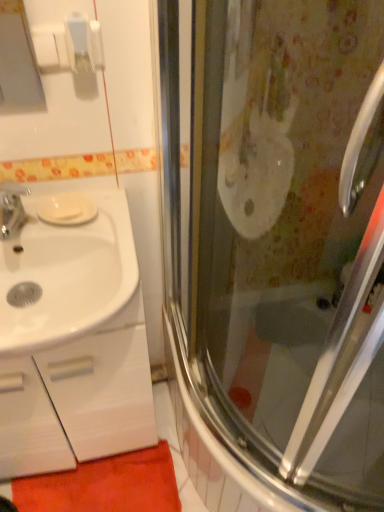
Question: Does white glossy sink at left touch white matte soap at left?

Choices:
 (A) no
 (B) yes

Answer: (A)

Question: Are white glossy sink at left and white matte soap at left located far from each other?

Choices:
 (A) yes
 (B) no

Answer: (B)

Question: Is white glossy sink at left shorter than white matte soap at left?

Choices:
 (A) no
 (B) yes

Answer: (A)

Question: Is white glossy sink at left to the right of white matte soap at left from the viewer's perspective?

Choices:
 (A) yes
 (B) no

Answer: (B)

Question: Is white glossy sink at left thinner than white matte soap at left?

Choices:
 (A) no
 (B) yes

Answer: (A)

Question: Considering the positions of point (74, 212) and point (97, 228), is point (74, 212) closer or farther from the camera than point (97, 228)?

Choices:
 (A) farther
 (B) closer

Answer: (A)

Question: Would you say white matte soap at left is inside or outside white glossy sink at left?

Choices:
 (A) inside
 (B) outside

Answer: (A)

Question: Relative to white glossy sink at left, is white matte soap at left in front or behind?

Choices:
 (A) front
 (B) behind

Answer: (B)

Question: Considering the positions of white matte soap at left and white glossy sink at left in the image, is white matte soap at left taller or shorter than white glossy sink at left?

Choices:
 (A) tall
 (B) short

Answer: (B)

Question: From a real-world perspective, is white glossy cabinet at left above or below white glossy sink at left?

Choices:
 (A) below
 (B) above

Answer: (A)

Question: Is point (36, 433) closer or farther from the camera than point (46, 307)?

Choices:
 (A) closer
 (B) farther

Answer: (B)

Question: Is white glossy cabinet at left inside or outside of white glossy sink at left?

Choices:
 (A) outside
 (B) inside

Answer: (A)

Question: In terms of size, does white glossy cabinet at left appear bigger or smaller than white glossy sink at left?

Choices:
 (A) big
 (B) small

Answer: (A)

Question: Based on their positions, is orange carpet at lower left located to the left or right of white matte soap at left?

Choices:
 (A) left
 (B) right

Answer: (A)

Question: Considering the positions of orange carpet at lower left and white matte soap at left in the image, is orange carpet at lower left taller or shorter than white matte soap at left?

Choices:
 (A) short
 (B) tall

Answer: (B)